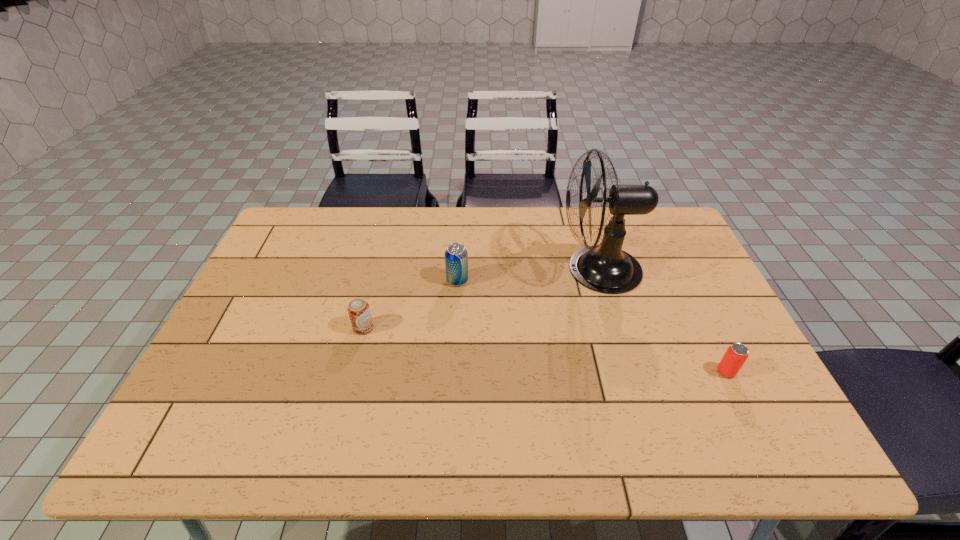
Where is `vacant area that lies between the farthest beer can and the second nearest object`? The width and height of the screenshot is (960, 540). vacant area that lies between the farthest beer can and the second nearest object is located at coordinates (410, 304).

Identify the location of empty space between the second object from left to right and the second nearest object. (410, 304).

Where is `object that stands as the second closest to the leftmost beer can`? This screenshot has height=540, width=960. object that stands as the second closest to the leftmost beer can is located at coordinates (605, 268).

At what (x,y) coordinates should I click in order to perform the action: click on object that ranks as the third closest to the third object from left to right. Please return your answer as a coordinate pair (x, y). Looking at the image, I should click on (358, 309).

Where is `beer can that is the second closest one to the second nearest object`? The height and width of the screenshot is (540, 960). beer can that is the second closest one to the second nearest object is located at coordinates pos(737,353).

The width and height of the screenshot is (960, 540). In order to click on beer can that is the closest to the second beer can from left to right in this screenshot , I will do `click(358, 309)`.

You are a GUI agent. You are given a task and a screenshot of the screen. Output one action in this format:
    pyautogui.click(x=<x>, y=<y>)
    Task: Click on the vacant area in the image that satisfies the following two spatial constraints: 1. on the front-facing side of the rightmost beer can; 2. on the right side of the second object from right to left
    
    Given the screenshot: What is the action you would take?
    pyautogui.click(x=630, y=372)

The height and width of the screenshot is (540, 960). Find the location of `vacant region that satisfies the following two spatial constraints: 1. on the front-facing side of the fan; 2. on the right side of the nearest object`. vacant region that satisfies the following two spatial constraints: 1. on the front-facing side of the fan; 2. on the right side of the nearest object is located at coordinates (630, 372).

You are a GUI agent. You are given a task and a screenshot of the screen. Output one action in this format:
    pyautogui.click(x=<x>, y=<y>)
    Task: Click on the vacant area in the image that satisfies the following two spatial constraints: 1. on the front-facing side of the nearest object; 2. on the right side of the fan
    
    Given the screenshot: What is the action you would take?
    pyautogui.click(x=630, y=372)

At what (x,y) coordinates should I click in order to perform the action: click on vacant space that satisfies the following two spatial constraints: 1. on the front side of the nearest beer can; 2. on the left side of the second beer can from right to left. Please return your answer as a coordinate pair (x, y). Looking at the image, I should click on (452, 372).